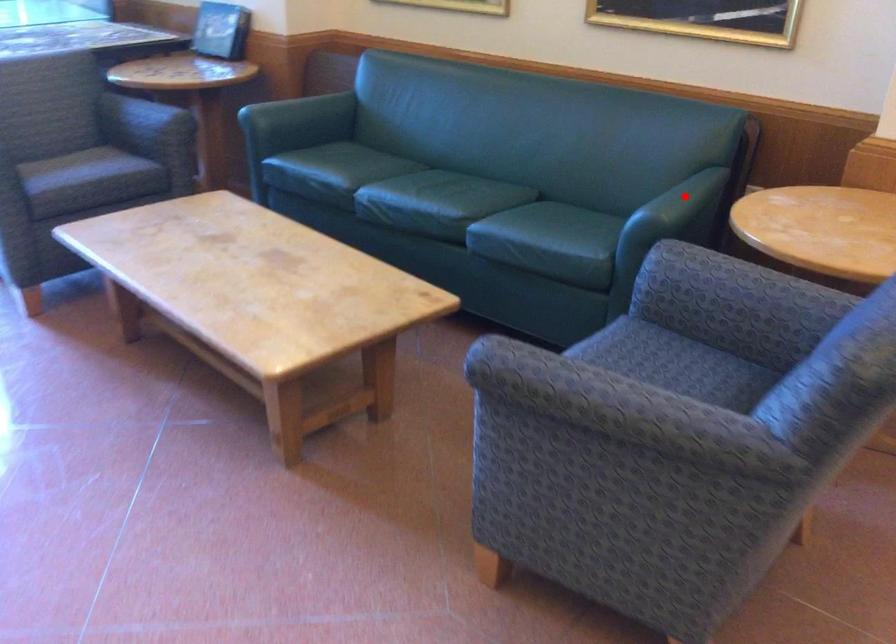
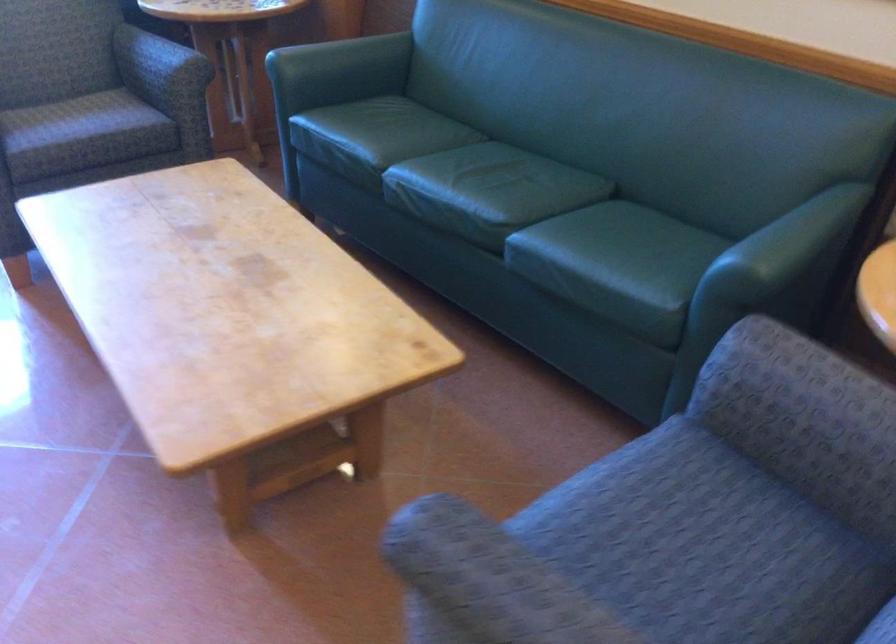
Question: I am providing you with two images of the same scene from different viewpoints. A red point is shown in image1. For the corresponding object point in image2, is it positioned nearer or farther from the camera?

Choices:
 (A) Nearer
 (B) Farther

Answer: (A)